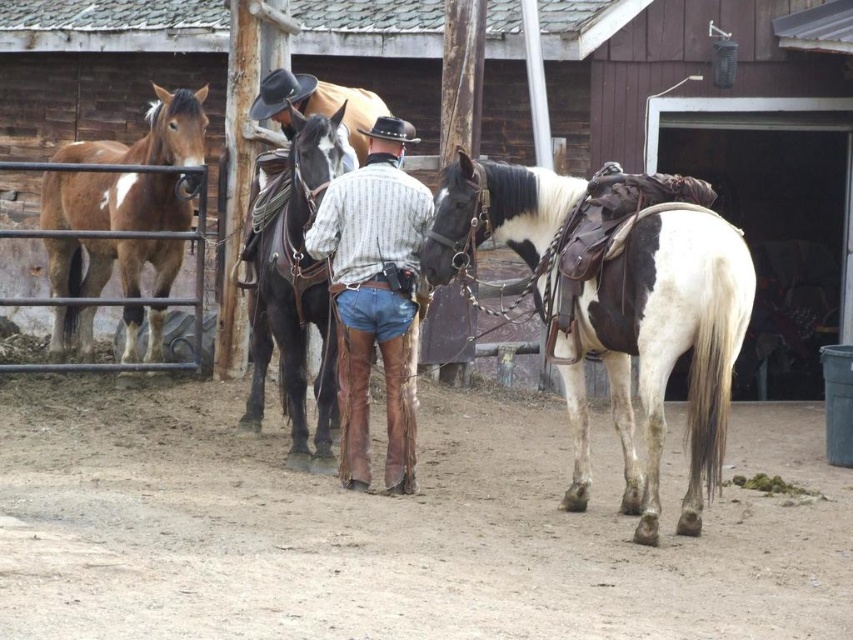
Between white and black speckled saddle at right and black leather horse at center, which one is positioned lower?

white and black speckled saddle at right is below.

In the scene shown: Does white and black speckled saddle at right come behind black leather horse at center?

No.

Is point (483, 170) positioned behind point (294, 253)?

No, (483, 170) is in front of (294, 253).

This screenshot has height=640, width=853. Identify the location of white and black speckled saddle at right. (668, 348).

In the scene shown: Does brown leather boots at center appear under black leather horse at center?

Yes.

Who is higher up, brown leather boots at center or black leather horse at center?

black leather horse at center is higher up.

Identify the location of brown leather boots at center. (374, 296).

Does white and black speckled saddle at right come in front of brown leather boots at center?

Yes.

Looking at this image, how far apart are white and black speckled saddle at right and brown leather boots at center?

The distance of white and black speckled saddle at right from brown leather boots at center is 36.16 inches.

In order to click on white and black speckled saddle at right in this screenshot , I will do `click(668, 348)`.

Where is `white and black speckled saddle at right`? The height and width of the screenshot is (640, 853). white and black speckled saddle at right is located at coordinates (668, 348).